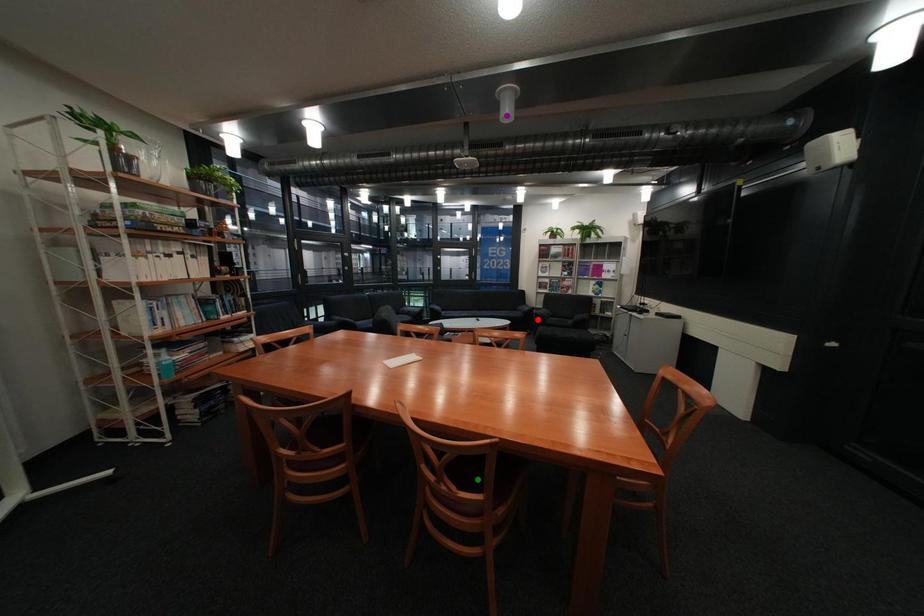
In the scene shown: Order these from nearest to farthest:
purple point, red point, green point

1. green point
2. purple point
3. red point